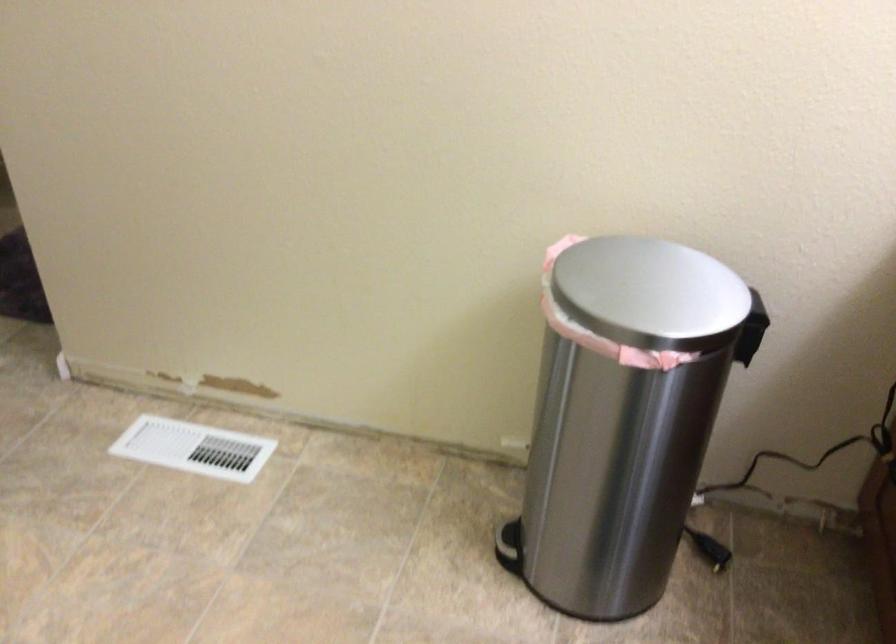
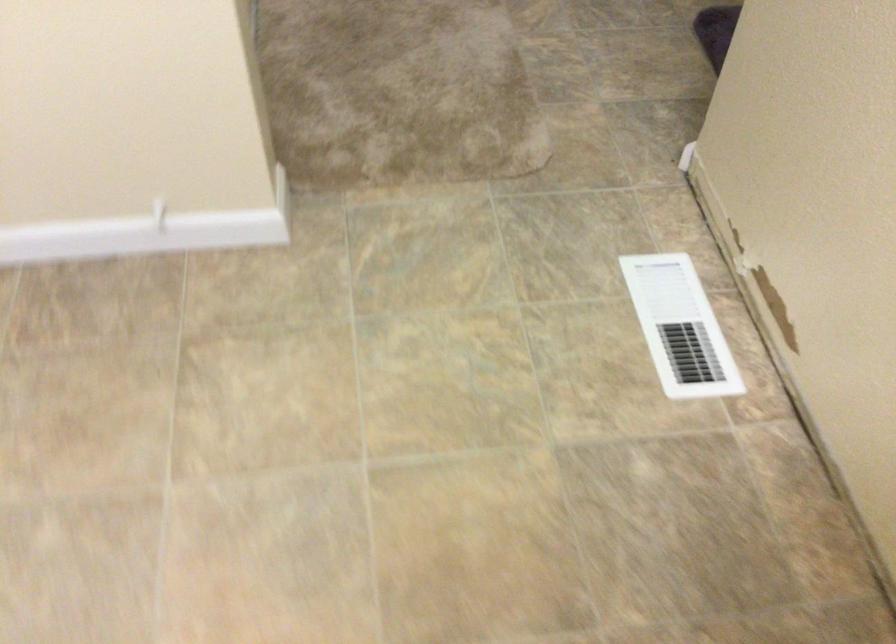
Where in the second image is the point corresponding to point 202,447 from the first image?

(679, 327)